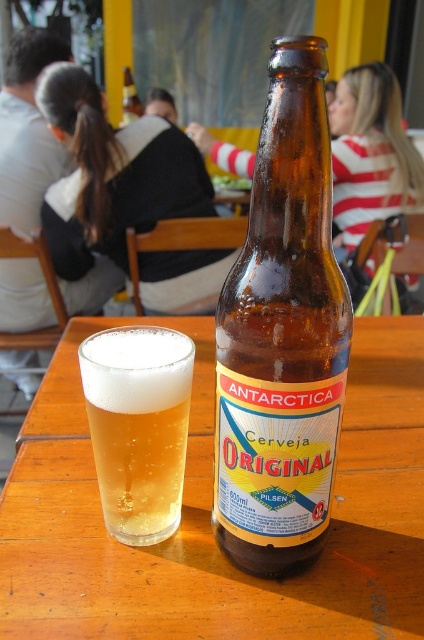
Looking at this image, can you confirm if clear glass beer at center is smaller than striped fabric shirt at upper center?

Correct, clear glass beer at center occupies less space than striped fabric shirt at upper center.

Which is more to the left, clear glass beer at center or striped fabric shirt at upper center?

striped fabric shirt at upper center is more to the left.

Locate an element on the screen. clear glass beer at center is located at coordinates (139, 426).

Does clear glass beer at center have a larger size compared to brown glass bottle at upper center?

Incorrect, clear glass beer at center is not larger than brown glass bottle at upper center.

Where is `clear glass beer at center`? The height and width of the screenshot is (640, 424). clear glass beer at center is located at coordinates coord(139,426).

Locate an element on the screen. The width and height of the screenshot is (424, 640). clear glass beer at center is located at coordinates (139, 426).

Measure the distance between wooden table at center and camera.

13.56 inches

Consider the image. Can you confirm if wooden table at center is positioned to the left of brown glass bottle at center?

Indeed, wooden table at center is positioned on the left side of brown glass bottle at center.

This screenshot has width=424, height=640. What do you see at coordinates (209, 516) in the screenshot? I see `wooden table at center` at bounding box center [209, 516].

Image resolution: width=424 pixels, height=640 pixels. I want to click on wooden table at center, so click(x=209, y=516).